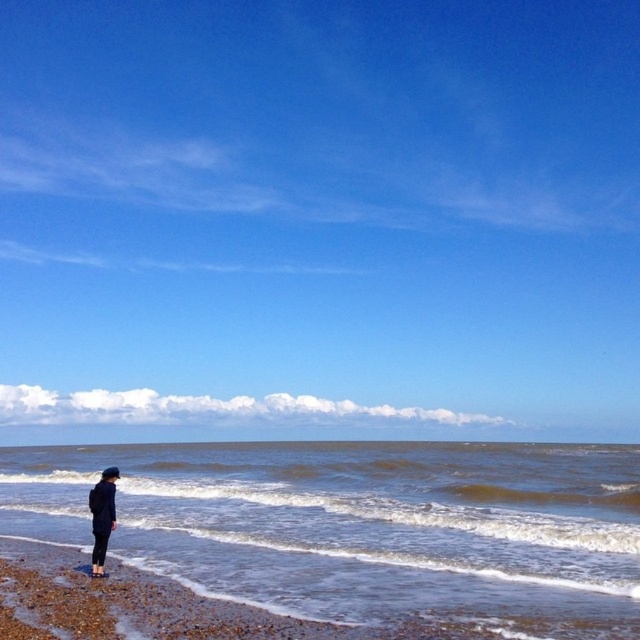
Question: Is brown liquid water at lower left closer to camera compared to dark blue fabric jacket at lower left?

Choices:
 (A) no
 (B) yes

Answer: (B)

Question: Is brown liquid water at lower left bigger than dark blue fabric jacket at lower left?

Choices:
 (A) no
 (B) yes

Answer: (B)

Question: Is brown liquid water at lower left wider than dark blue fabric jacket at lower left?

Choices:
 (A) no
 (B) yes

Answer: (B)